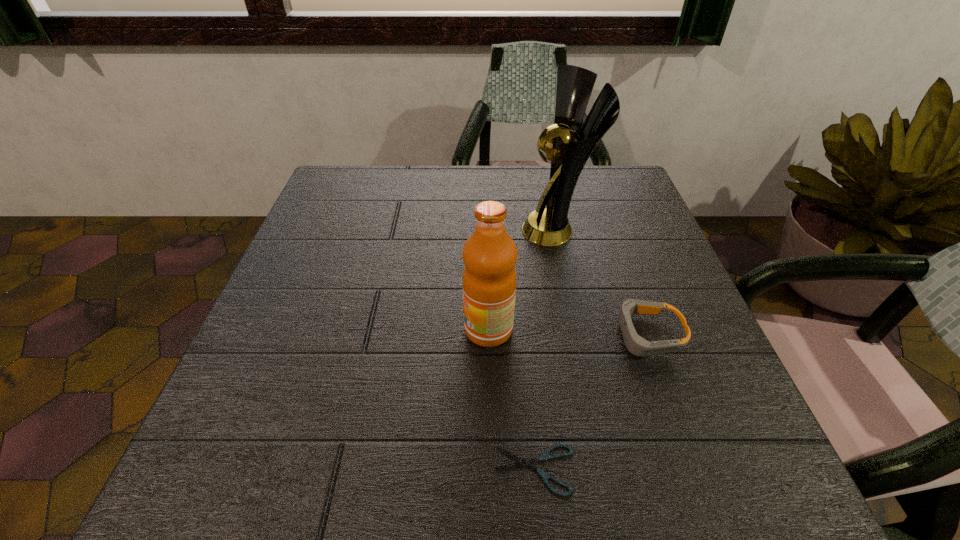
What are the coordinates of `object situated at the far right corner` in the screenshot? It's located at (550, 226).

The width and height of the screenshot is (960, 540). In the image, there is a desktop. What are the coordinates of `vacant area at the far edge` in the screenshot? It's located at (446, 166).

Locate an element on the screen. The height and width of the screenshot is (540, 960). blank space at the left edge is located at coordinates (324, 260).

Where is `blank space at the right edge of the desktop`? The width and height of the screenshot is (960, 540). blank space at the right edge of the desktop is located at coordinates (653, 393).

Locate an element on the screen. This screenshot has width=960, height=540. free space at the far left corner is located at coordinates (343, 171).

This screenshot has width=960, height=540. Find the location of `free spot at the near left corner of the desktop`. free spot at the near left corner of the desktop is located at coordinates (276, 500).

In the image, there is a desktop. At what (x,y) coordinates should I click in order to perform the action: click on vacant space at the far right corner. Please return your answer as a coordinate pair (x, y). The width and height of the screenshot is (960, 540). Looking at the image, I should click on (645, 211).

This screenshot has height=540, width=960. In order to click on unoccupied position between the third tallest object and the shortest object in this screenshot , I will do `click(590, 402)`.

The width and height of the screenshot is (960, 540). I want to click on vacant area that lies between the shears and the farthest object, so click(545, 349).

Locate an element on the screen. The height and width of the screenshot is (540, 960). blank region between the third tallest object and the second tallest object is located at coordinates (567, 332).